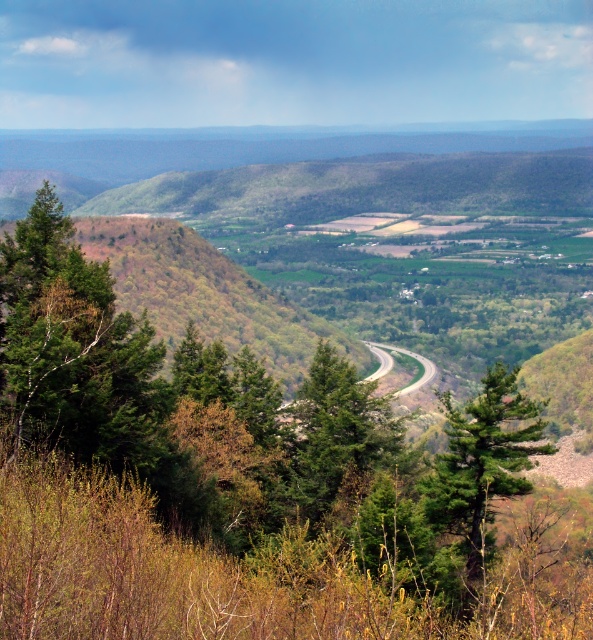
Question: Which of the following is the farthest from the observer?

Choices:
 (A) green matte tree at center
 (B) green leafy tree at center

Answer: (A)

Question: Can you confirm if green leafy tree at center is positioned to the right of green textured tree at center?

Choices:
 (A) no
 (B) yes

Answer: (A)

Question: Is green matte tree at center to the right of green textured tree at center from the viewer's perspective?

Choices:
 (A) no
 (B) yes

Answer: (B)

Question: Which point appears farthest from the camera in this image?

Choices:
 (A) (368, 600)
 (B) (438, 480)

Answer: (B)

Question: Which object is closer to the camera taking this photo?

Choices:
 (A) green textured tree at center
 (B) green matte tree at center
 (C) green leafy tree at center

Answer: (C)

Question: Can you confirm if green leafy tree at center is smaller than green matte tree at center?

Choices:
 (A) no
 (B) yes

Answer: (A)